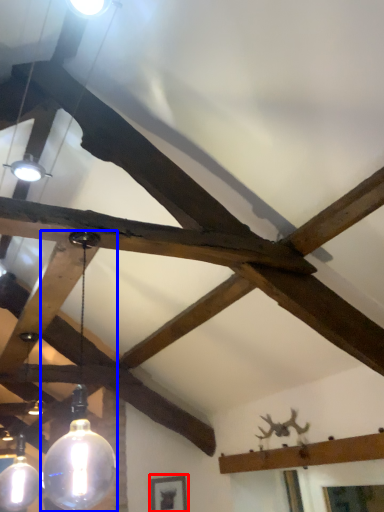
Question: Which object is closer to the camera taking this photo, picture frame (highlighted by a red box) or lamp (highlighted by a blue box)?

Choices:
 (A) picture frame
 (B) lamp

Answer: (B)